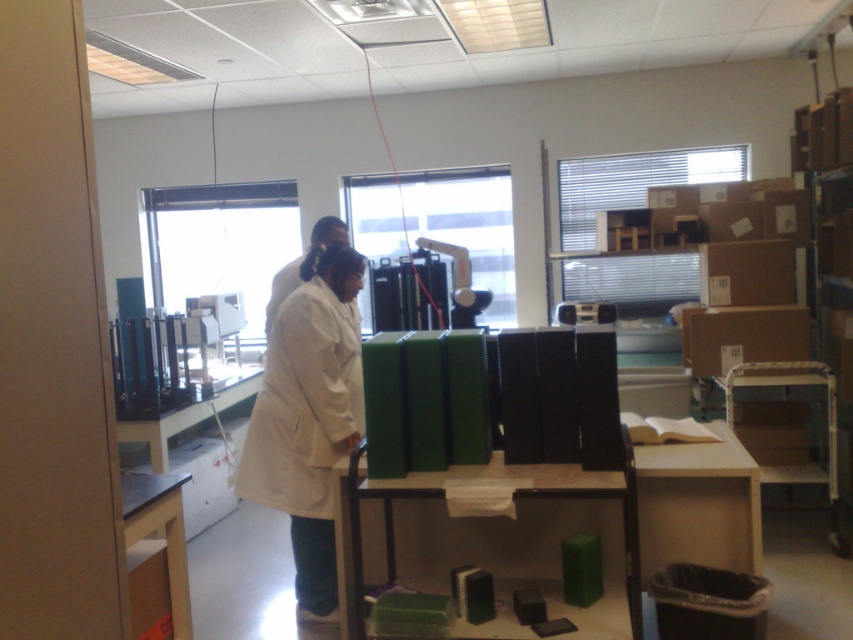
Question: Which object is farther from the camera taking this photo?

Choices:
 (A) white matte lab coat at center
 (B) white lab coat at center

Answer: (B)

Question: Among these objects, which one is nearest to the camera?

Choices:
 (A) white matte lab coat at center
 (B) white lab coat at center

Answer: (A)

Question: Observing the image, what is the correct spatial positioning of white matte lab coat at center in reference to white lab coat at center?

Choices:
 (A) above
 (B) below

Answer: (B)

Question: Which point is closer to the camera?

Choices:
 (A) white matte lab coat at center
 (B) white lab coat at center

Answer: (A)

Question: Is white matte lab coat at center positioned in front of white lab coat at center?

Choices:
 (A) no
 (B) yes

Answer: (B)

Question: Can you confirm if white matte lab coat at center is positioned above white lab coat at center?

Choices:
 (A) yes
 (B) no

Answer: (B)